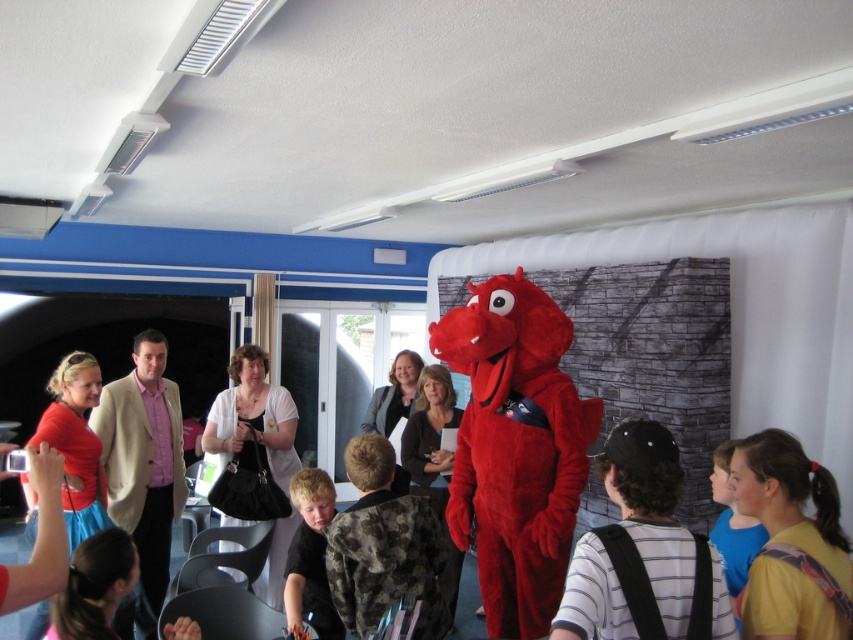
What do you see at coordinates (515, 449) in the screenshot? The height and width of the screenshot is (640, 853). I see `fuzzy red dragon at center` at bounding box center [515, 449].

Is the position of fuzzy red dragon at center less distant than that of black fabric dress at center?

Yes, it is in front of black fabric dress at center.

What do you see at coordinates (515, 449) in the screenshot? Image resolution: width=853 pixels, height=640 pixels. I see `fuzzy red dragon at center` at bounding box center [515, 449].

In order to click on fuzzy red dragon at center in this screenshot , I will do `click(515, 449)`.

At what (x,y) coordinates should I click in order to perform the action: click on fuzzy red dragon at center. Please return your answer as a coordinate pair (x, y). Looking at the image, I should click on (515, 449).

Does fuzzy red dragon at center have a greater height compared to blonde hair boy at center?

Yes, fuzzy red dragon at center is taller than blonde hair boy at center.

Who is more distant from viewer, (486, 436) or (322, 477)?

Point (322, 477)

Locate an element on the screen. The image size is (853, 640). fuzzy red dragon at center is located at coordinates (515, 449).

Is the position of striped cotton shirt at center less distant than that of yellow printed shirt at lower right?

Yes, it is.

Between point (677, 456) and point (792, 636), which one is positioned in front?

Point (792, 636) is more forward.

At what (x,y) coordinates should I click in order to perform the action: click on striped cotton shirt at center. Please return your answer as a coordinate pair (x, y). Looking at the image, I should click on (643, 554).